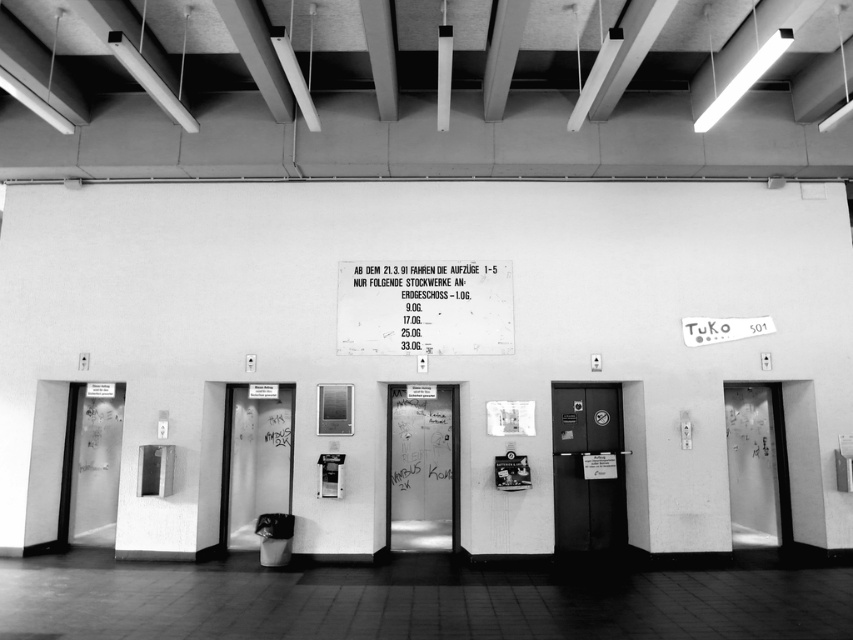
Question: Is smooth concrete wall at center to the left of metallic elevator door at center from the viewer's perspective?

Choices:
 (A) no
 (B) yes

Answer: (B)

Question: Which of the following is the farthest from the observer?

Choices:
 (A) metallic sign at center
 (B) metallic elevator door at center

Answer: (B)

Question: Which object is positioned farthest from the transparent frosted glass elevator at center?

Choices:
 (A) metallic elevator door at center
 (B) smooth concrete wall at center

Answer: (B)

Question: Observing the image, what is the correct spatial positioning of metallic sign at center in reference to metallic elevator door at center?

Choices:
 (A) below
 (B) above

Answer: (B)

Question: Which of these objects is positioned farthest from the metallic elevator door at center?

Choices:
 (A) smooth concrete wall at center
 (B) metallic sign at center
 (C) transparent frosted glass elevator at center

Answer: (C)

Question: Is smooth concrete wall at center further to camera compared to transparent frosted glass elevator at center?

Choices:
 (A) yes
 (B) no

Answer: (B)